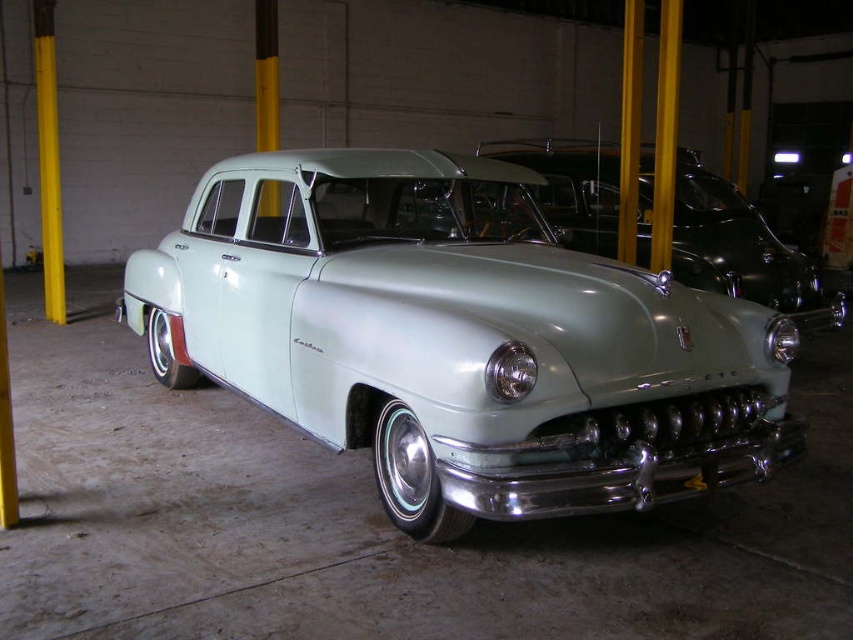
You are a photographer standing at the entrance of the garage. You want to take a photo of the satin light green car at center. If your camera requires you to be at least 8 feet away to avoid distortion, is the current distance sufficient?

The satin light green car at center is 9.30 feet away from the camera, which is more than the minimum required distance of 8 feet. Therefore, the current distance is sufficient to avoid distortion.

You are standing at the point marked as point (579, 336) in a garage with a vintage car. You need to walk to the garage exit, which is 5 meters away from your current position. Can you reach the exit without moving past the vintage car?

The distance between you and the camera is 3.10 meters. Since the garage exit is 5 meters away from your current position, you can reach the exit without moving past the vintage car as the required distance is greater than the distance to the camera.